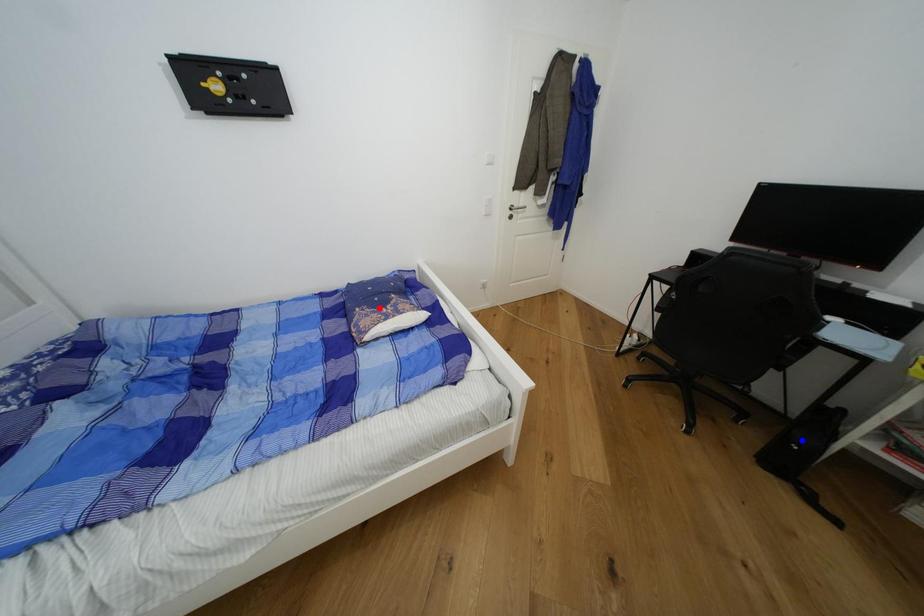
Question: Which of the two points in the image is closer to the camera?

Choices:
 (A) Blue point is closer.
 (B) Red point is closer.

Answer: (A)